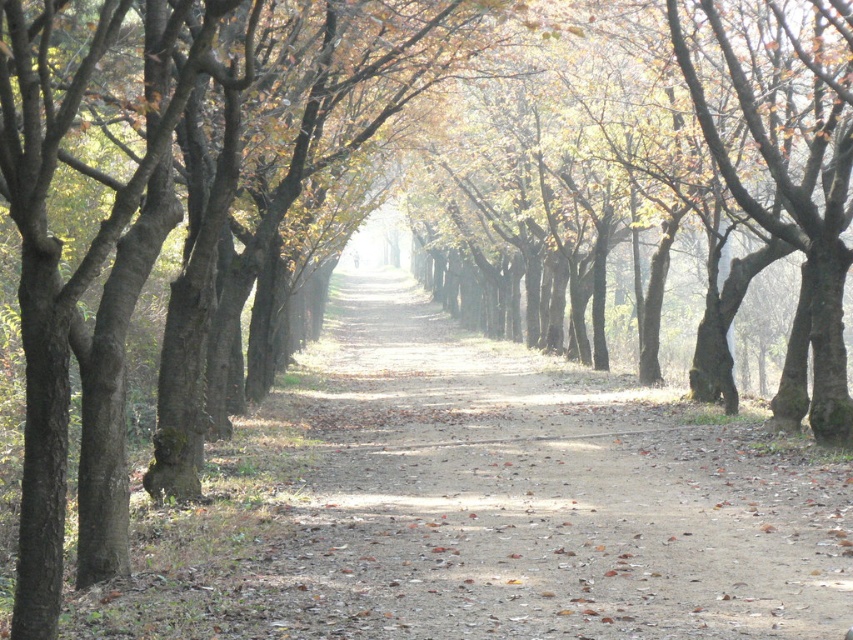
Question: Which of the following is the farthest from the observer?

Choices:
 (A) (697, 6)
 (B) (757, 432)
 (C) (837, 144)

Answer: (A)

Question: Which is farther from the dirt path at center?

Choices:
 (A) brown smooth tree at center
 (B) brown rough bark tree at right

Answer: (A)

Question: Observing the image, what is the correct spatial positioning of dirt path at center in reference to brown smooth tree at center?

Choices:
 (A) above
 (B) below

Answer: (B)

Question: Considering the real-world distances, which object is closest to the dirt path at center?

Choices:
 (A) brown smooth tree at center
 (B) brown rough bark tree at right

Answer: (B)

Question: In this image, where is dirt path at center located relative to brown smooth tree at center?

Choices:
 (A) left
 (B) right

Answer: (A)

Question: Does dirt path at center come in front of brown rough bark tree at right?

Choices:
 (A) no
 (B) yes

Answer: (B)